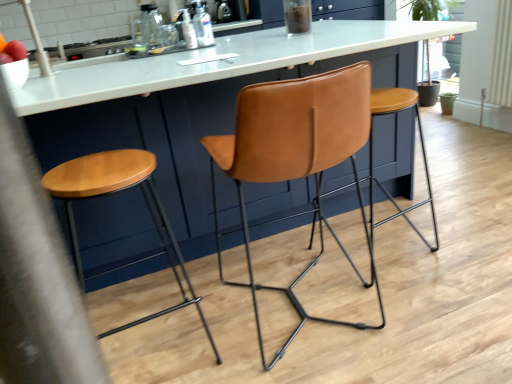
How much space does transparent plastic bottle at upper center, the second bottle when ordered from front to back, occupy vertically?

transparent plastic bottle at upper center, the second bottle when ordered from front to back, is 8.72 inches in height.

In the scene shown: Measure the distance between matte brown stool at center, which is the 2th stool in right-to-left order, and camera.

The distance of matte brown stool at center, which is the 2th stool in right-to-left order, from camera is 1.11 meters.

What do you see at coordinates (188, 30) in the screenshot? The height and width of the screenshot is (384, 512). I see `translucent plastic bottle at upper center, the third bottle viewed from the top` at bounding box center [188, 30].

Describe the element at coordinates (141, 29) in the screenshot. I see `transparent glass bottle at upper center, the third bottle when ordered from right to left` at that location.

The width and height of the screenshot is (512, 384). Describe the element at coordinates (296, 158) in the screenshot. I see `cognac leather chair at center` at that location.

This screenshot has width=512, height=384. I want to click on leather stool at center, acting as the second stool starting from the left, so click(372, 155).

From a real-world perspective, is transparent glass bottle at upper center, the first bottle from the back, on transparent plastic bottle at upper center, arranged as the second bottle when viewed from the back?

Yes.

Could you tell me if transparent glass bottle at upper center, the first bottle from the back, is facing transparent plastic bottle at upper center, the second bottle when ordered from front to back?

Yes, transparent glass bottle at upper center, the first bottle from the back, is oriented towards transparent plastic bottle at upper center, the second bottle when ordered from front to back.

Is transparent glass bottle at upper center, the third bottle when ordered from right to left, bigger than transparent plastic bottle at upper center, the second bottle in the top-to-bottom sequence?

Yes, transparent glass bottle at upper center, the third bottle when ordered from right to left, is bigger than transparent plastic bottle at upper center, the second bottle in the top-to-bottom sequence.

Which object is wider, transparent glass bottle at upper center, placed as the 3th bottle when sorted from front to back, or transparent plastic bottle at upper center, the second bottle when ordered from bottom to top?

transparent glass bottle at upper center, placed as the 3th bottle when sorted from front to back, is wider.

Is cognac leather chair at center positioned in front of leather stool at center, the 1th stool in the right-to-left sequence?

Yes, cognac leather chair at center is in front of leather stool at center, the 1th stool in the right-to-left sequence.

From a real-world perspective, relative to leather stool at center, acting as the second stool starting from the left, is cognac leather chair at center vertically above or below?

cognac leather chair at center is situated higher than leather stool at center, acting as the second stool starting from the left, in the real world.

Is cognac leather chair at center taller or shorter than leather stool at center, the 1th stool in the right-to-left sequence?

Considering their sizes, cognac leather chair at center has more height than leather stool at center, the 1th stool in the right-to-left sequence.

Is cognac leather chair at center wider or thinner than leather stool at center, acting as the second stool starting from the left?

cognac leather chair at center is wider than leather stool at center, acting as the second stool starting from the left.

From a real-world perspective, between leather stool at center, acting as the second stool starting from the left, and transparent plastic bottle at upper center, arranged as the second bottle when viewed from the back, who is vertically lower?

In real-world perspective, leather stool at center, acting as the second stool starting from the left, is lower.

Which is nearer, (370, 234) or (194, 24)?

Clearly, point (370, 234) is closer to the camera than point (194, 24).

Are leather stool at center, acting as the second stool starting from the left, and transparent plastic bottle at upper center, which is counted as the third bottle, starting from the left, beside each other?

No, leather stool at center, acting as the second stool starting from the left, is not making contact with transparent plastic bottle at upper center, which is counted as the third bottle, starting from the left.

Based on the photo, considering the sizes of objects leather stool at center, the 1th stool in the right-to-left sequence, and transparent plastic bottle at upper center, the second bottle in the top-to-bottom sequence, in the image provided, who is taller, leather stool at center, the 1th stool in the right-to-left sequence, or transparent plastic bottle at upper center, the second bottle in the top-to-bottom sequence,?

leather stool at center, the 1th stool in the right-to-left sequence, is taller.

Can you confirm if transparent plastic bottle at upper center, the first bottle when ordered from right to left, is positioned to the left of leather stool at center, acting as the second stool starting from the left?

Yes.

Can you tell me how much transparent plastic bottle at upper center, the second bottle when ordered from bottom to top, and leather stool at center, the 1th stool in the right-to-left sequence, differ in facing direction?

0.934 degrees separate the facing orientations of transparent plastic bottle at upper center, the second bottle when ordered from bottom to top, and leather stool at center, the 1th stool in the right-to-left sequence.

From the image's perspective, which one is positioned higher, transparent plastic bottle at upper center, the second bottle in the top-to-bottom sequence, or leather stool at center, acting as the second stool starting from the left?

transparent plastic bottle at upper center, the second bottle in the top-to-bottom sequence, is shown above in the image.

Based on the photo, which of these two, transparent plastic bottle at upper center, the second bottle when ordered from front to back, or leather stool at center, the 1th stool in the right-to-left sequence, is bigger?

leather stool at center, the 1th stool in the right-to-left sequence, is bigger.

Where is `the 1st bottle in front when counting from the transparent glass bottle at upper center, marked as the 1th bottle in a top-to-bottom arrangement`? the 1st bottle in front when counting from the transparent glass bottle at upper center, marked as the 1th bottle in a top-to-bottom arrangement is located at coordinates (203, 26).

Can you tell me how much transparent plastic bottle at upper center, arranged as the second bottle when viewed from the back, and transparent glass bottle at upper center, the third bottle when ordered from right to left, differ in facing direction?

The angular difference between transparent plastic bottle at upper center, arranged as the second bottle when viewed from the back, and transparent glass bottle at upper center, the third bottle when ordered from right to left, is 179 degrees.

Which is in front, point (205, 12) or point (147, 20)?

The point (205, 12) is closer to the camera.

In terms of height, does transparent plastic bottle at upper center, the first bottle when ordered from right to left, look taller or shorter compared to transparent glass bottle at upper center, which ranks as the 3th bottle in bottom-to-top order?

transparent plastic bottle at upper center, the first bottle when ordered from right to left, is shorter than transparent glass bottle at upper center, which ranks as the 3th bottle in bottom-to-top order.

Is transparent plastic bottle at upper center, the second bottle in the top-to-bottom sequence, oriented away from matte brown stool at center, which is the 2th stool in right-to-left order?

transparent plastic bottle at upper center, the second bottle in the top-to-bottom sequence, does not have its back to matte brown stool at center, which is the 2th stool in right-to-left order.

Considering the sizes of objects transparent plastic bottle at upper center, the second bottle when ordered from bottom to top, and matte brown stool at center, which is the 2th stool in right-to-left order, in the image provided, who is taller, transparent plastic bottle at upper center, the second bottle when ordered from bottom to top, or matte brown stool at center, which is the 2th stool in right-to-left order,?

Standing taller between the two is matte brown stool at center, which is the 2th stool in right-to-left order.

Which is more to the left, transparent plastic bottle at upper center, arranged as the second bottle when viewed from the back, or matte brown stool at center, which is counted as the first stool, starting from the left?

From the viewer's perspective, matte brown stool at center, which is counted as the first stool, starting from the left, appears more on the left side.

From a real-world perspective, is transparent plastic bottle at upper center, the first bottle when ordered from right to left, on top of matte brown stool at center, which is the 2th stool in right-to-left order?

Yes, from a real-world perspective, transparent plastic bottle at upper center, the first bottle when ordered from right to left, is over matte brown stool at center, which is the 2th stool in right-to-left order

Which of these two, cognac leather chair at center or translucent plastic bottle at upper center, the 2th bottle in the right-to-left sequence, is smaller?

translucent plastic bottle at upper center, the 2th bottle in the right-to-left sequence.

Is cognac leather chair at center at the left side of translucent plastic bottle at upper center, which is the 1th bottle in front-to-back order?

In fact, cognac leather chair at center is to the right of translucent plastic bottle at upper center, which is the 1th bottle in front-to-back order.

Is cognac leather chair at center in front of translucent plastic bottle at upper center, the 2th bottle in the left-to-right sequence?

Yes, the depth of cognac leather chair at center is less than that of translucent plastic bottle at upper center, the 2th bottle in the left-to-right sequence.

In terms of height, does cognac leather chair at center look taller or shorter compared to translucent plastic bottle at upper center, the first bottle ordered from the bottom?

In the image, cognac leather chair at center appears to be taller than translucent plastic bottle at upper center, the first bottle ordered from the bottom.

Where is `bottle above the transparent plastic bottle at upper center, the first bottle when ordered from right to left (from a real-world perspective)`? Image resolution: width=512 pixels, height=384 pixels. bottle above the transparent plastic bottle at upper center, the first bottle when ordered from right to left (from a real-world perspective) is located at coordinates (141, 29).

You are a GUI agent. You are given a task and a screenshot of the screen. Output one action in this format:
    pyautogui.click(x=<x>, y=<y>)
    Task: Click on the chair below the leather stool at center, acting as the second stool starting from the left (from the image's perspective)
    
    Given the screenshot: What is the action you would take?
    pyautogui.click(x=296, y=158)

Looking at the image, which one is located closer to cognac leather chair at center, translucent plastic bottle at upper center, the 2th bottle in the right-to-left sequence, or transparent plastic bottle at upper center, the second bottle in the top-to-bottom sequence?

transparent plastic bottle at upper center, the second bottle in the top-to-bottom sequence, lies closer to cognac leather chair at center than the other object.

Estimate the real-world distances between objects in this image. Which object is further from cognac leather chair at center, leather stool at center, acting as the second stool starting from the left, or transparent glass bottle at upper center, the third bottle when ordered from right to left?

Based on the image, transparent glass bottle at upper center, the third bottle when ordered from right to left, appears to be further to cognac leather chair at center.

In the scene shown: Considering their positions, is translucent plastic bottle at upper center, the 2th bottle in the left-to-right sequence, positioned closer to cognac leather chair at center than transparent glass bottle at upper center, the third bottle when ordered from right to left?

translucent plastic bottle at upper center, the 2th bottle in the left-to-right sequence, is closer to cognac leather chair at center.

Based on their spatial positions, is leather stool at center, the 1th stool in the right-to-left sequence, or cognac leather chair at center closer to matte brown stool at center, which is the 2th stool in right-to-left order?

cognac leather chair at center is closer to matte brown stool at center, which is the 2th stool in right-to-left order.

When comparing their distances from transparent glass bottle at upper center, the third bottle when ordered from right to left, does matte brown stool at center, which is counted as the first stool, starting from the left, or leather stool at center, the 1th stool in the right-to-left sequence, seem further?

leather stool at center, the 1th stool in the right-to-left sequence, is positioned further to the anchor transparent glass bottle at upper center, the third bottle when ordered from right to left.

Looking at the image, which one is located closer to transparent plastic bottle at upper center, the second bottle in the top-to-bottom sequence, cognac leather chair at center or leather stool at center, the 1th stool in the right-to-left sequence?

cognac leather chair at center is closer to transparent plastic bottle at upper center, the second bottle in the top-to-bottom sequence.

In the scene shown: Which object lies further to the anchor point cognac leather chair at center, transparent plastic bottle at upper center, the second bottle when ordered from front to back, or matte brown stool at center, which is counted as the first stool, starting from the left?

transparent plastic bottle at upper center, the second bottle when ordered from front to back, lies further to cognac leather chair at center than the other object.

From the image, which object appears to be farther from transparent glass bottle at upper center, which ranks as the 3th bottle in bottom-to-top order, translucent plastic bottle at upper center, the 2th bottle in the left-to-right sequence, or transparent plastic bottle at upper center, the second bottle when ordered from bottom to top?

Among the two, transparent plastic bottle at upper center, the second bottle when ordered from bottom to top, is located further to transparent glass bottle at upper center, which ranks as the 3th bottle in bottom-to-top order.

At what (x,y) coordinates should I click in order to perform the action: click on stool between matte brown stool at center, which is counted as the first stool, starting from the left, and transparent glass bottle at upper center, the first bottle viewed from the left, in the front-back direction. Please return your answer as a coordinate pair (x, y). Looking at the image, I should click on (372, 155).

The image size is (512, 384). What are the coordinates of `stool between transparent plastic bottle at upper center, arranged as the second bottle when viewed from the back, and matte brown stool at center, which is the 2th stool in right-to-left order, in the vertical direction` in the screenshot? It's located at (372, 155).

At what (x,y) coordinates should I click in order to perform the action: click on chair located between matte brown stool at center, which is the 2th stool in right-to-left order, and leather stool at center, the 1th stool in the right-to-left sequence, in the left-right direction. Please return your answer as a coordinate pair (x, y). Looking at the image, I should click on (296, 158).

Where is `bottle located between translucent plastic bottle at upper center, the first bottle ordered from the bottom, and transparent glass bottle at upper center, the third bottle when ordered from right to left, in the depth direction`? bottle located between translucent plastic bottle at upper center, the first bottle ordered from the bottom, and transparent glass bottle at upper center, the third bottle when ordered from right to left, in the depth direction is located at coordinates (203, 26).